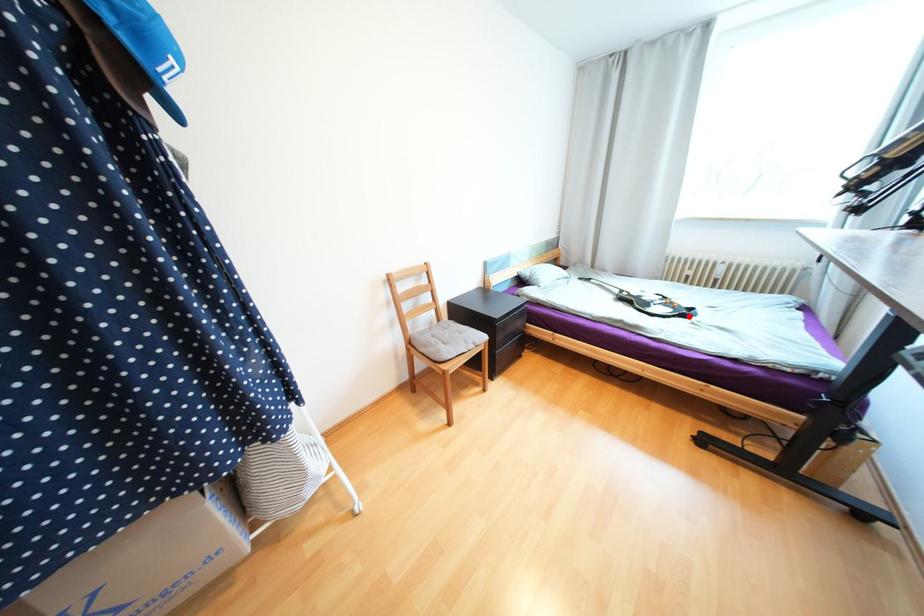
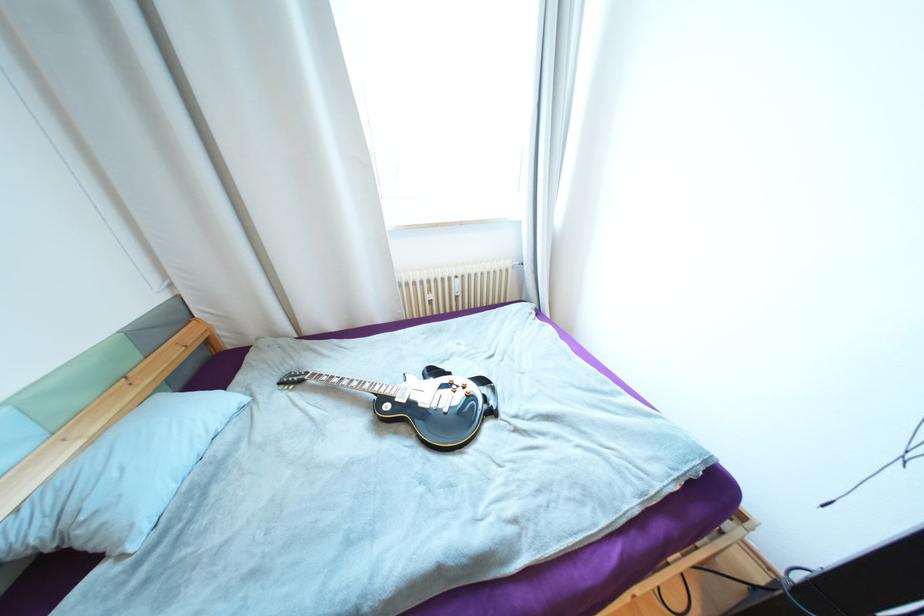
Find the pixel in the second image that matches the highlighted location in the first image.

(497, 413)